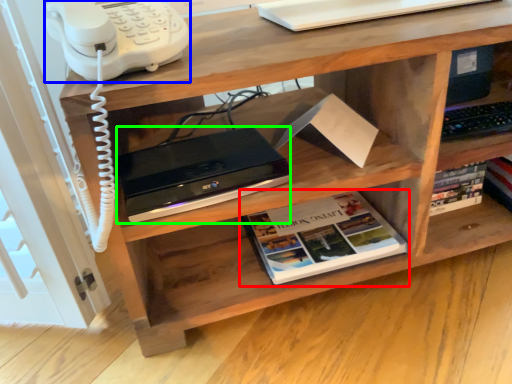
Question: Which object is positioned closest to book (highlighted by a red box)? Select from corded phone (highlighted by a blue box) and computer (highlighted by a green box).

Choices:
 (A) corded phone
 (B) computer

Answer: (B)